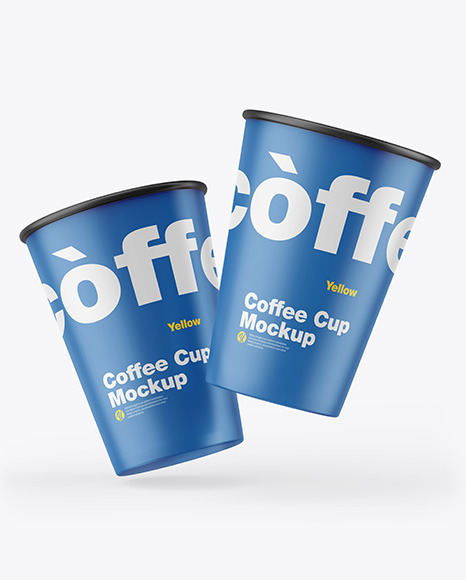
What are the coordinates of `bottom of cup` in the screenshot? It's located at (179, 456), (271, 398).